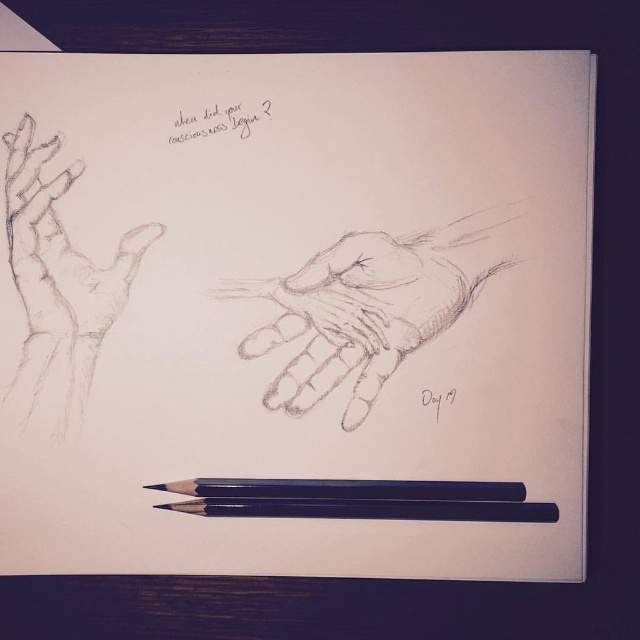
Who is higher up, graphite sketch hand at upper left or black smooth pencil at bottom?

Positioned higher is graphite sketch hand at upper left.

Find the location of a particular element. This screenshot has height=640, width=640. graphite sketch hand at upper left is located at coordinates point(58,276).